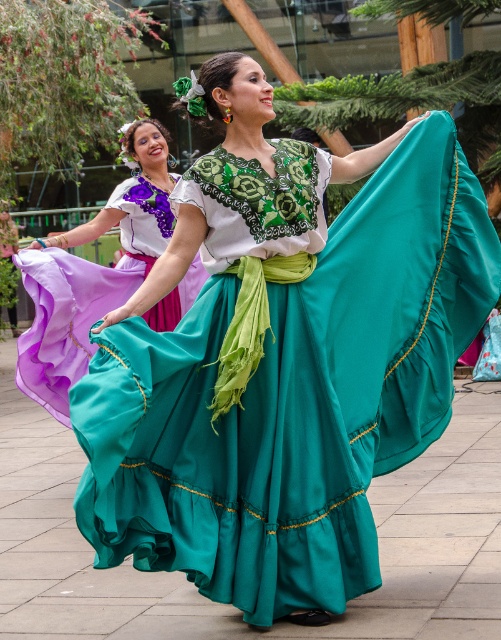
Between point (145, 365) and point (127, 260), which one is positioned behind?

The point (127, 260) is behind.

Is teal satin dress at center thinner than matte purple skirt at left?

No, teal satin dress at center is not thinner than matte purple skirt at left.

What do you see at coordinates (293, 397) in the screenshot? This screenshot has width=501, height=640. I see `teal satin dress at center` at bounding box center [293, 397].

Locate an element on the screen. The width and height of the screenshot is (501, 640). teal satin dress at center is located at coordinates (293, 397).